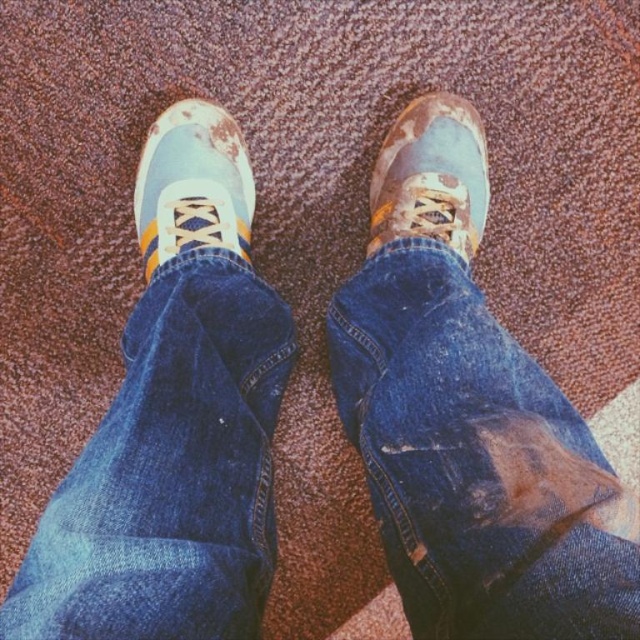
Question: Does matte blue sneaker at center have a lesser width compared to blue suede sneaker at center?

Choices:
 (A) no
 (B) yes

Answer: (A)

Question: Which point is farther from the camera taking this photo?

Choices:
 (A) (486, 195)
 (B) (243, 259)
 (C) (532, 509)

Answer: (A)

Question: Based on their relative distances, which object is farther from the matte blue sneaker at center?

Choices:
 (A) blue suede sneaker at center
 (B) ripped denim jeans at lower right

Answer: (B)

Question: Among these points, which one is farthest from the camera?

Choices:
 (A) (419, 250)
 (B) (147, 209)

Answer: (B)

Question: Can you confirm if matte blue sneaker at center is positioned below blue suede sneaker at center?

Choices:
 (A) yes
 (B) no

Answer: (A)

Question: From the image, what is the correct spatial relationship of matte blue sneaker at center in relation to blue suede sneaker at center?

Choices:
 (A) left
 (B) right

Answer: (A)